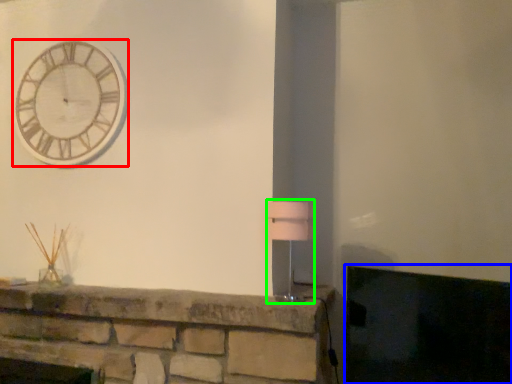
Question: Estimate the real-world distances between objects in this image. Which object is farther from wall clock (highlighted by a red box), fireplace (highlighted by a blue box) or table lamp (highlighted by a green box)?

Choices:
 (A) fireplace
 (B) table lamp

Answer: (A)